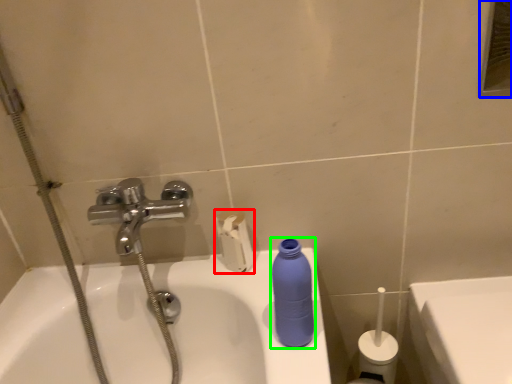
Question: Based on their relative distances, which object is farther from toilet paper (highlighted by a red box)? Choose from mirror (highlighted by a blue box) and cleaning product (highlighted by a green box).

Choices:
 (A) mirror
 (B) cleaning product

Answer: (A)